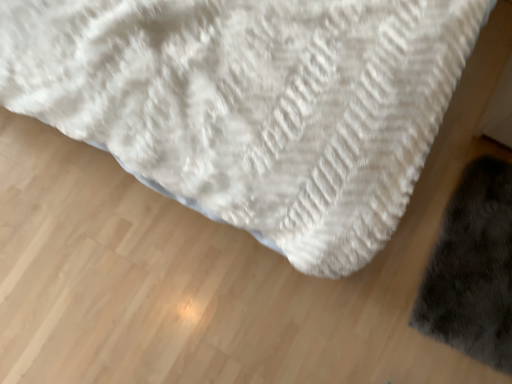
Question: Looking at their shapes, would you say white fluffy towel at center is wider or thinner than dark gray fluffy mat at lower right?

Choices:
 (A) wide
 (B) thin

Answer: (A)

Question: From the image's perspective, is white fluffy towel at center positioned above or below dark gray fluffy mat at lower right?

Choices:
 (A) below
 (B) above

Answer: (B)

Question: Is white fluffy towel at center bigger or smaller than dark gray fluffy mat at lower right?

Choices:
 (A) big
 (B) small

Answer: (A)

Question: Is dark gray fluffy mat at lower right inside or outside of white fluffy towel at center?

Choices:
 (A) outside
 (B) inside

Answer: (A)

Question: In terms of height, does dark gray fluffy mat at lower right look taller or shorter compared to white fluffy towel at center?

Choices:
 (A) short
 (B) tall

Answer: (A)

Question: From a real-world perspective, is dark gray fluffy mat at lower right physically located above or below white fluffy towel at center?

Choices:
 (A) below
 (B) above

Answer: (A)

Question: In the image, is dark gray fluffy mat at lower right positioned in front of or behind white fluffy towel at center?

Choices:
 (A) front
 (B) behind

Answer: (B)